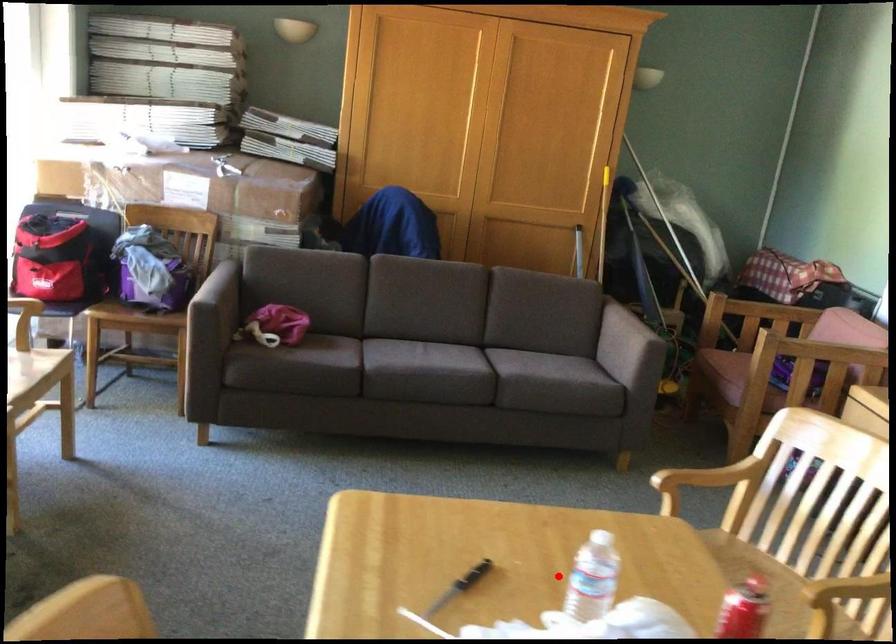
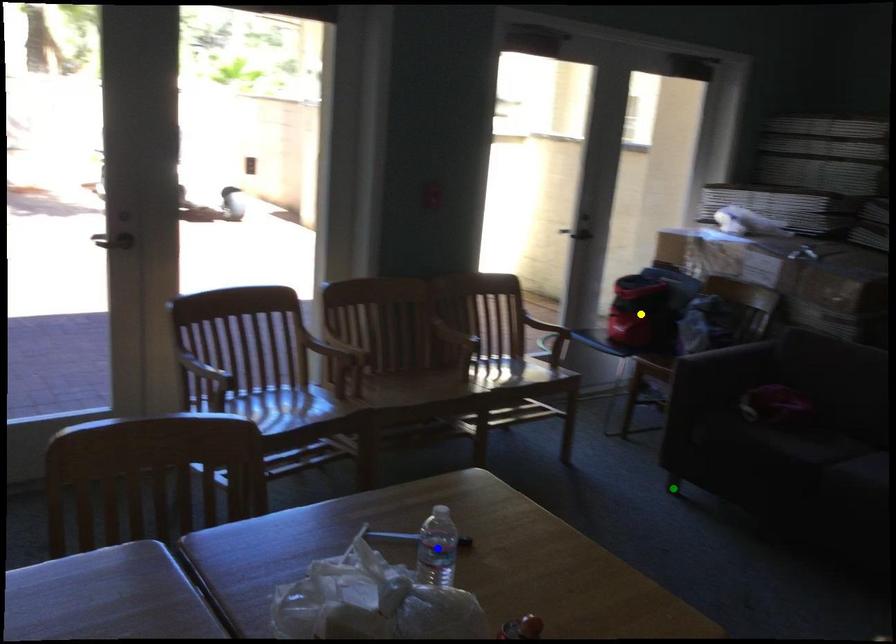
Question: I am providing you with two images of the same scene from different viewpoints. A red point is marked on the first image. You are given multiple points on the second image. Can you choose the point in image 2 that corresponds to the point in image 1?

Choices:
 (A) green point
 (B) yellow point
 (C) blue point

Answer: (C)